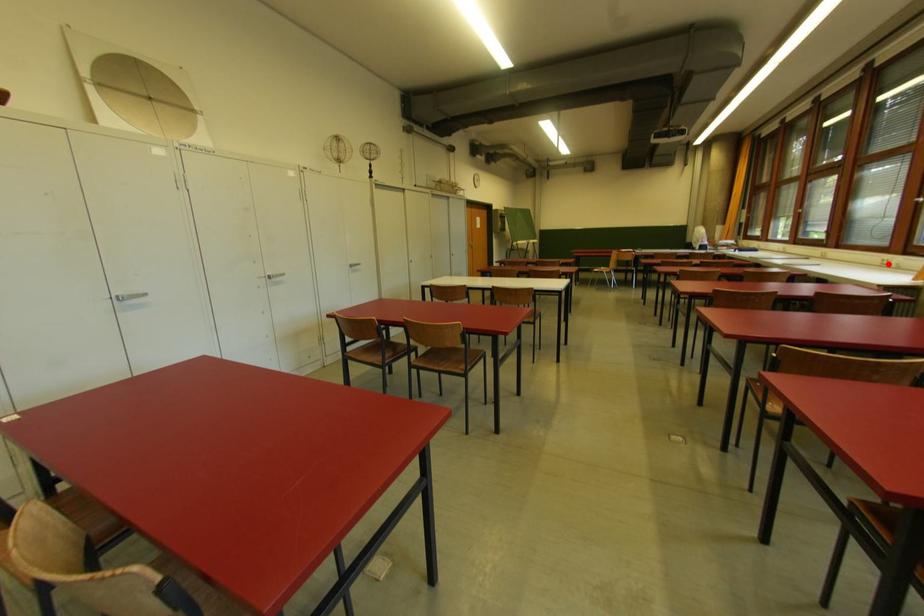
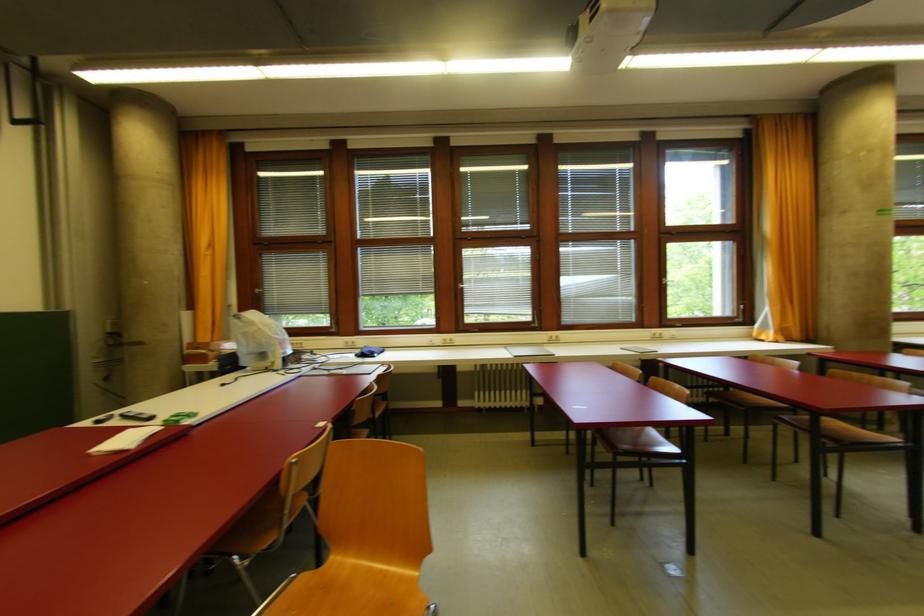
Locate, in the second image, the point that corresponds to the highlighted location in the first image.

(660, 338)